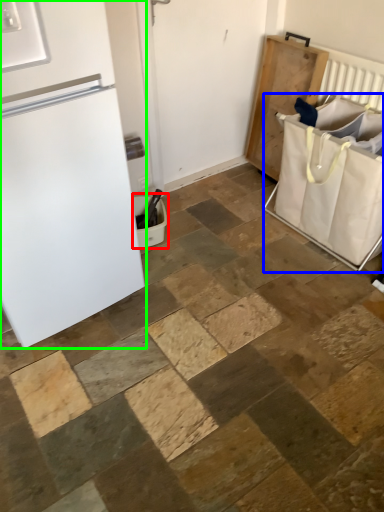
Question: Estimate the real-world distances between objects in this image. Which object is farther from laundry basket (highlighted by a red box), laundry basket (highlighted by a blue box) or refrigerator (highlighted by a green box)?

Choices:
 (A) laundry basket
 (B) refrigerator

Answer: (A)